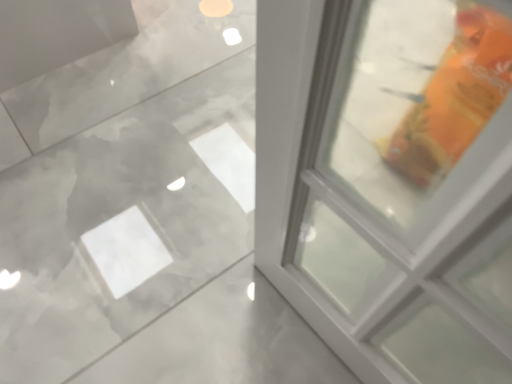
You are a GUI agent. You are given a task and a screenshot of the screen. Output one action in this format:
    pyautogui.click(x=<x>, y=<y>)
    Task: Click on the orange matte bag at right
    
    Given the screenshot: What is the action you would take?
    pyautogui.click(x=455, y=97)

Measure the distance between point [470,89] and camera.

Point [470,89] is 31.65 inches away from camera.

Describe the element at coordinates (455, 97) in the screenshot. The height and width of the screenshot is (384, 512). I see `orange matte bag at right` at that location.

Where is `orange matte bag at right`? orange matte bag at right is located at coordinates (455, 97).